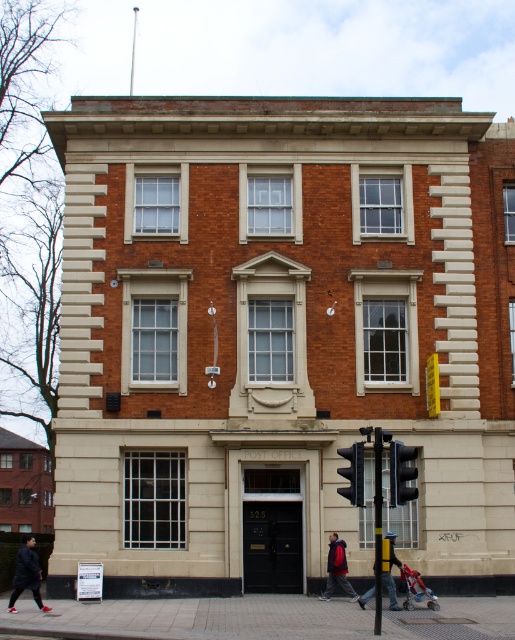
You are standing in front of the two story building and want to determine which of the two points, point [8,605] or point [413,452], is closer to you. Based on their positions, which point is nearer?

Point [8,605] is closer to you because it is further to the camera than point [413,452].

You are standing at the base of the flagpole in front of the building. You see a dark gray jacket at lower left and a red jacket at center. Which jacket is closer to you?

The dark gray jacket at lower left is 10.78 meters away from the red jacket at center. Since you are at the flagpole, the distance between them doesn not indicate their proximity to you. Without additional information about their positions relative to the flagpole, it is impossible to determine which jacket is closer.